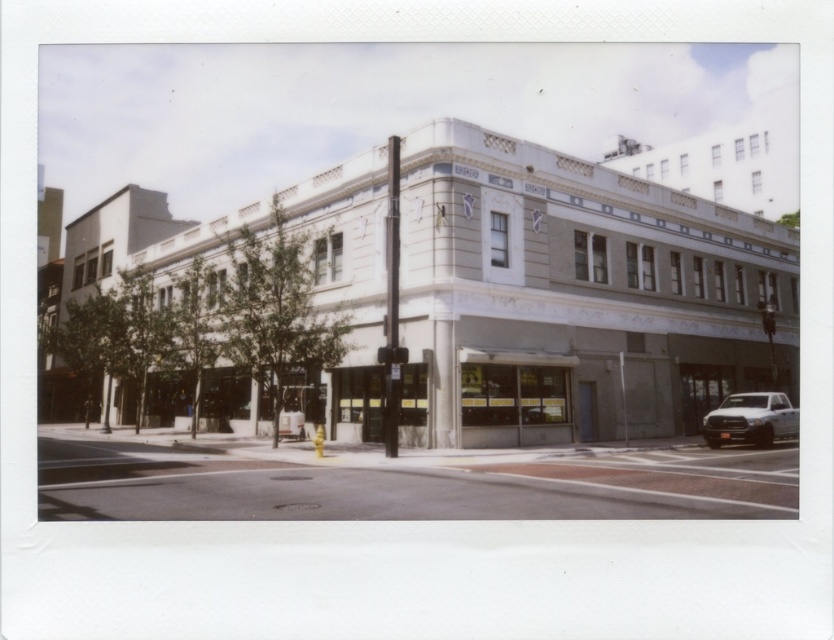
Question: Does concrete sidewalk at lower center appear on the left side of white matte truck at lower right?

Choices:
 (A) yes
 (B) no

Answer: (A)

Question: Can you confirm if concrete sidewalk at lower center is positioned above white matte truck at lower right?

Choices:
 (A) yes
 (B) no

Answer: (B)

Question: Which point is closer to the camera?

Choices:
 (A) (219, 516)
 (B) (737, 417)

Answer: (A)

Question: Is concrete sidewalk at lower center in front of white matte truck at lower right?

Choices:
 (A) no
 (B) yes

Answer: (B)

Question: Which point is closer to the camera?

Choices:
 (A) (438, 484)
 (B) (742, 432)

Answer: (A)